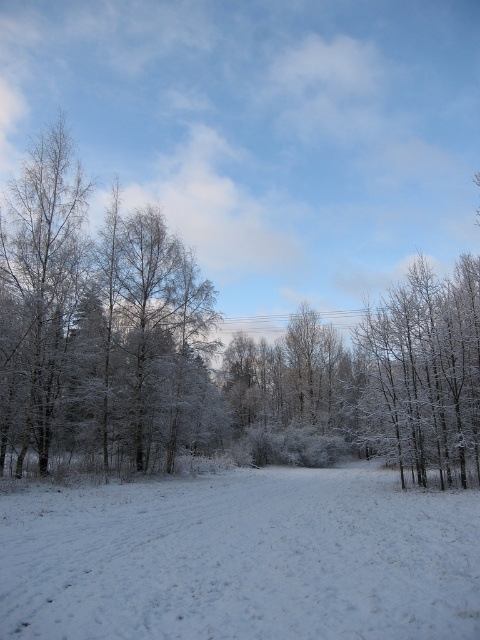
You are an explorer in the winter landscape. You see the white fluffy snow at center and the white frosty tree at left. Which object is positioned to the right of the other?

The white fluffy snow at center is to the right of the white frosty tree at left.

You are an observer standing in the middle of a snowy forest path. You notice two white frosty trees at right and white frosty tree at left. Which tree is positioned to the east if the sun is setting in the west?

The white frosty trees at right are positioned to the east because they are to the right of the white frosty tree at left, and since the sun is setting in the west, the right side of the image corresponds to the east direction.

You are an observer standing in the middle of a snowy field. You notice two white frosty trees at right and a white frosty tree at left. Which group of trees appears bigger in size?

The white frosty trees at right appears bigger in size compared to the white frosty tree at left.